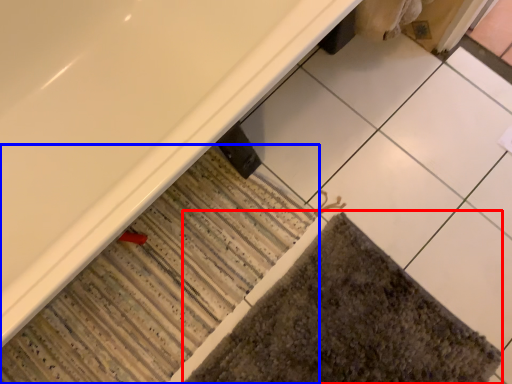
Question: Which object appears farthest to the camera in this image, bath mat (highlighted by a red box) or bath mat (highlighted by a blue box)?

Choices:
 (A) bath mat
 (B) bath mat

Answer: (B)